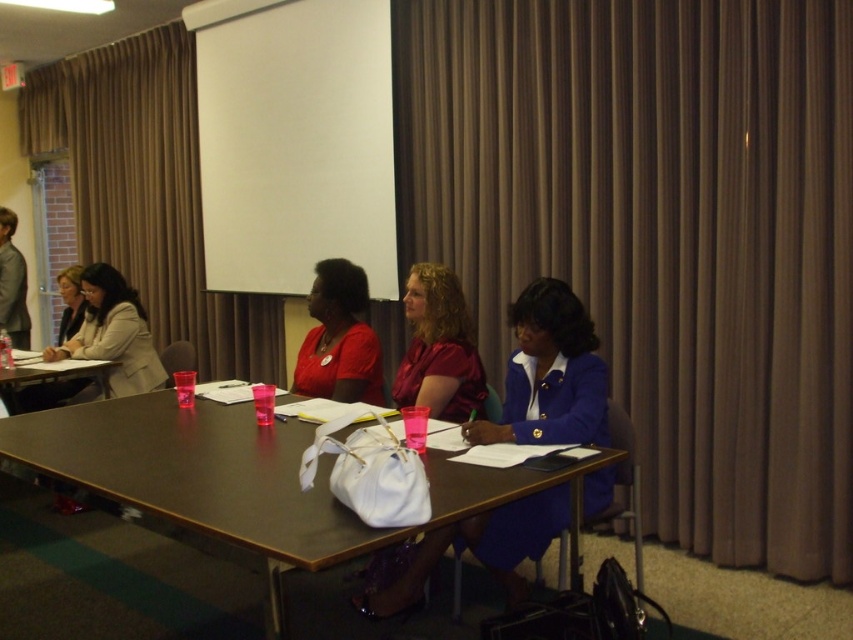
You are organizing a small event and need to place a decorative banner that is 1.2 meters wide on the table. The banner must be placed between the brown fabric curtain at center and the matte red shirt at center. Can the banner fit between them based on their widths?

The brown fabric curtain at center is wider than the matte red shirt at center. Since the banner is 1.2 meters wide, it depends on the actual width of the space between them. However, the description only states the curtain is wider than the shirt but does not provide exact measurements. Without specific dimensions, it is impossible to determine if the banner will fit.

You are attending a meeting and need to determine which clothing item takes up more horizontal space. Which one is wider between the matte red shirt at center and the matte beige blazer at left?

The matte beige blazer at left is wider than the matte red shirt at center.

You are an interior designer assessing the space in the meeting room. You need to determine if the brown fabric curtain at center can be used to cover the matte red shirt at center completely. Based on their sizes, what would you advise?

The brown fabric curtain at center has a larger size compared to matte red shirt at center, so it can be used to cover the matte red shirt at center completely.